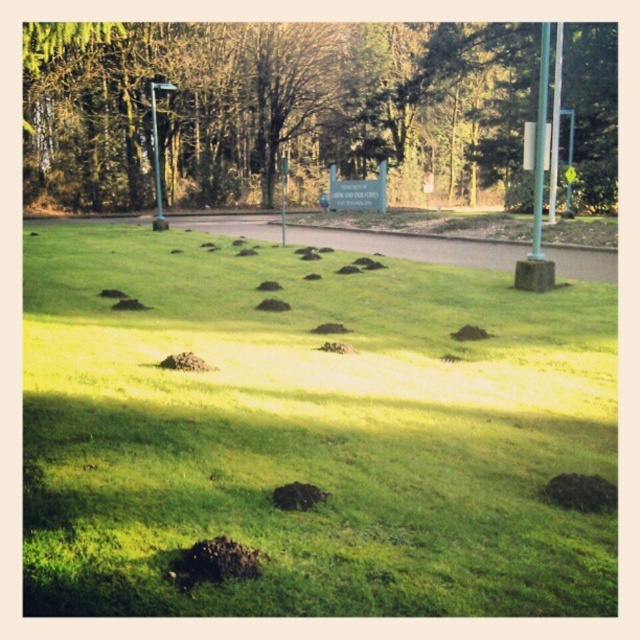
You are a gardener assessing the health of the lawn. You notice the dark brown dirt mounds at center and the green leafy tree at center. Which object has a narrower width?

The dark brown dirt mounds at center is thinner than the green leafy tree at center, so the dark brown dirt mounds at center has a narrower width.

You are standing at the point with coordinates point (476, 118) and want to walk to the point with coordinates point (368, 573). Which direction should you face to walk towards your destination?

You should face towards the direction of point (368, 573) because it is in front of point (476, 118), so walking towards it would be the correct direction.